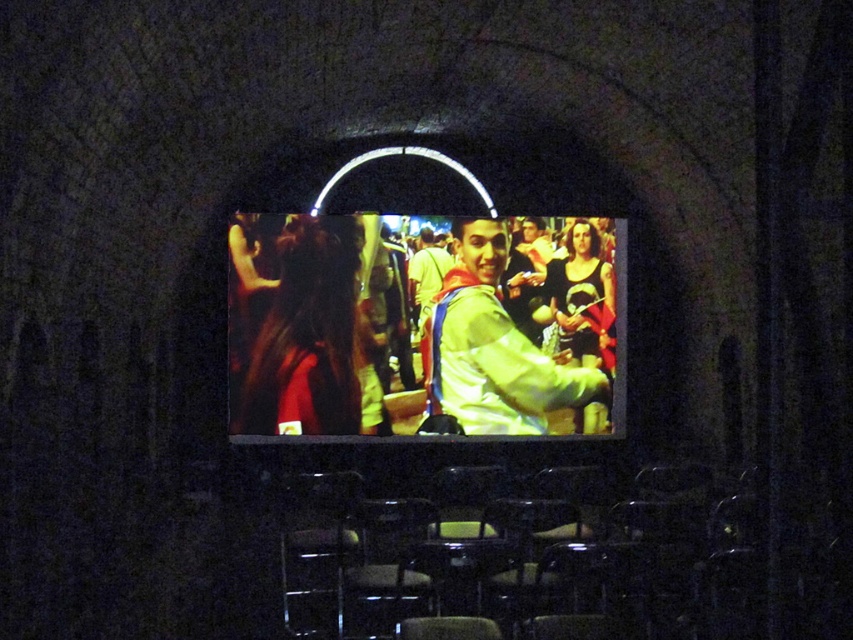
Based on the photo, can you confirm if shiny silver jacket at center is positioned to the right of light green fabric jacket at center?

Incorrect, shiny silver jacket at center is not on the right side of light green fabric jacket at center.

Locate an element on the screen. This screenshot has width=853, height=640. shiny silver jacket at center is located at coordinates tap(419, 324).